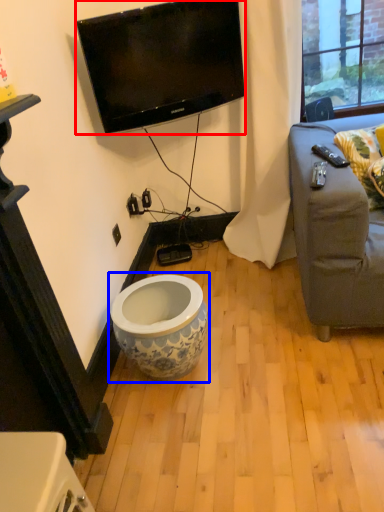
Question: Which object is further to the camera taking this photo, television (highlighted by a red box) or toilet (highlighted by a blue box)?

Choices:
 (A) television
 (B) toilet

Answer: (A)